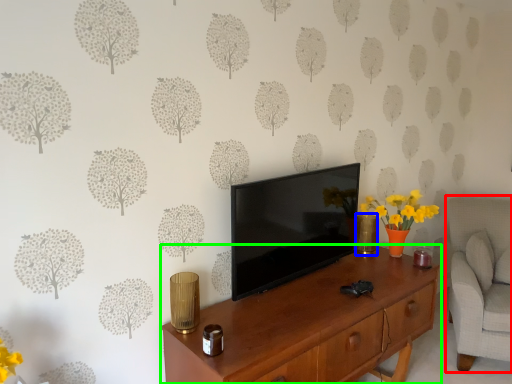
Question: Which is farther away from swivel chair (highlighted by a red box)? vase (highlighted by a blue box) or desk (highlighted by a green box)?

Choices:
 (A) vase
 (B) desk

Answer: (B)